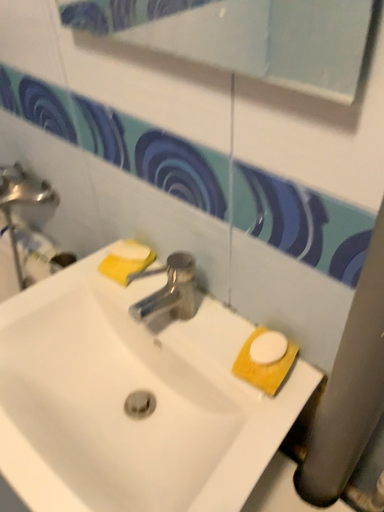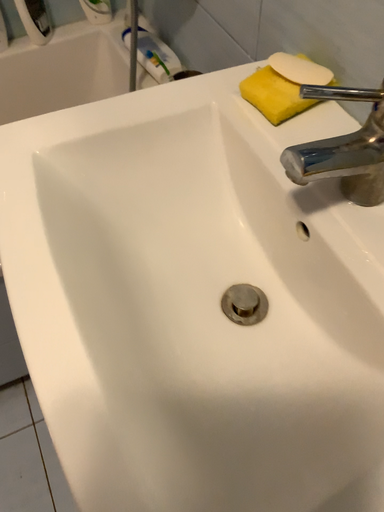
Question: Which way did the camera rotate in the video?

Choices:
 (A) rotated right
 (B) rotated left

Answer: (B)